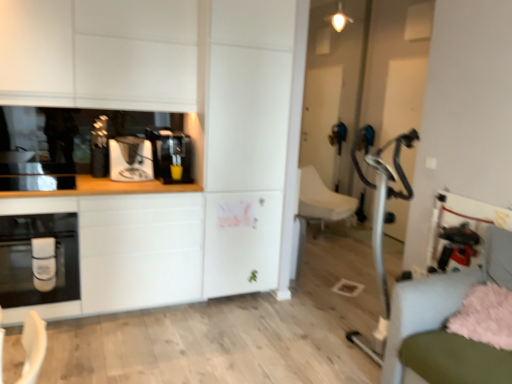
Measure the distance between point (x=173, y=40) and camera.

Point (x=173, y=40) and camera are 9.63 feet apart.

What do you see at coordinates (99, 54) in the screenshot? I see `white matte cabinet at upper left` at bounding box center [99, 54].

What do you see at coordinates (170, 156) in the screenshot? The image size is (512, 384). I see `black plastic coffee machine at left, the 2th coffee machine from the left` at bounding box center [170, 156].

What do you see at coordinates (484, 316) in the screenshot?
I see `fluffy pink pillow at lower right` at bounding box center [484, 316].

Image resolution: width=512 pixels, height=384 pixels. Find the location of `fluffy pink pillow at lower right`. fluffy pink pillow at lower right is located at coordinates (484, 316).

Looking at this image, measure the distance between point (x=5, y=179) and camera.

2.74 meters.

You are a GUI agent. You are given a task and a screenshot of the screen. Output one action in this format:
    pyautogui.click(x=<x>, y=<y>)
    Task: Click on the white matte cabinet at upper left
    
    Given the screenshot: What is the action you would take?
    pyautogui.click(x=99, y=54)

Which is in front, point (140, 74) or point (415, 301)?

The point (415, 301) is in front.

From a real-world perspective, between white matte cabinet at upper left and light blue fabric swivel chair at lower right, positioned as the second swivel chair in back-to-front order, who is vertically higher?

white matte cabinet at upper left.

Which of these two, white matte cabinet at upper left or light blue fabric swivel chair at lower right, acting as the 1th swivel chair starting from the front, is bigger?

With larger size is white matte cabinet at upper left.

Looking at this image, in the image, is white matte cabinet at upper left on the left side or the right side of light blue fabric swivel chair at lower right, acting as the 1th swivel chair starting from the front?

Based on their positions, white matte cabinet at upper left is located to the left of light blue fabric swivel chair at lower right, acting as the 1th swivel chair starting from the front.

Is point (408, 297) less distant than point (68, 217)?

Yes, it is.

Can we say light blue fabric swivel chair at lower right, acting as the 1th swivel chair starting from the front, lies outside matte black oven at left?

light blue fabric swivel chair at lower right, acting as the 1th swivel chair starting from the front, is positioned outside matte black oven at left.

Is light blue fabric swivel chair at lower right, positioned as the second swivel chair in back-to-front order, taller than matte black oven at left?

Yes.

Is white fabric swivel chair at center, placed as the 2th swivel chair when sorted from front to back, wider than black glossy toaster at left?

Yes.

Looking at the image, does white fabric swivel chair at center, positioned as the first swivel chair in back-to-front order, seem bigger or smaller compared to black glossy toaster at left?

Clearly, white fabric swivel chair at center, positioned as the first swivel chair in back-to-front order, is larger in size than black glossy toaster at left.

Consider the image. From the image's perspective, would you say white fabric swivel chair at center, positioned as the first swivel chair in back-to-front order, is shown under black glossy toaster at left?

Correct, white fabric swivel chair at center, positioned as the first swivel chair in back-to-front order, appears lower than black glossy toaster at left in the image.

Is white fabric swivel chair at center, placed as the 2th swivel chair when sorted from front to back, far from black glossy toaster at left?

Indeed, white fabric swivel chair at center, placed as the 2th swivel chair when sorted from front to back, is not near black glossy toaster at left.

Which is more to the right, white fabric swivel chair at center, positioned as the first swivel chair in back-to-front order, or matte black oven at left?

white fabric swivel chair at center, positioned as the first swivel chair in back-to-front order, is more to the right.

From the image's perspective, is white fabric swivel chair at center, positioned as the first swivel chair in back-to-front order, located above or below matte black oven at left?

white fabric swivel chair at center, positioned as the first swivel chair in back-to-front order, is above matte black oven at left.

Between white fabric swivel chair at center, positioned as the first swivel chair in back-to-front order, and matte black oven at left, which one has larger size?

Bigger between the two is white fabric swivel chair at center, positioned as the first swivel chair in back-to-front order.

Which object is thinner, white fabric swivel chair at center, placed as the 2th swivel chair when sorted from front to back, or matte black oven at left?

Thinner between the two is matte black oven at left.

Find the location of a particular element. The width and height of the screenshot is (512, 384). home appliance behind the fluffy pink pillow at lower right is located at coordinates (32, 257).

Are fluffy pink pillow at lower right and matte black oven at left beside each other?

fluffy pink pillow at lower right and matte black oven at left are not in contact.

From the image's perspective, who appears lower, fluffy pink pillow at lower right or matte black oven at left?

fluffy pink pillow at lower right, from the image's perspective.

From a real-world perspective, between fluffy pink pillow at lower right and matte black oven at left, who is vertically higher?

fluffy pink pillow at lower right is physically above.

Considering the positions of point (185, 151) and point (126, 160), is point (185, 151) closer or farther from the camera than point (126, 160)?

Point (185, 151).

From the image's perspective, which object appears higher, black plastic coffee machine at left, the 1th coffee machine positioned from the right, or satin black coffee machine at left, the 1th coffee machine positioned from the left?

From the image's view, black plastic coffee machine at left, the 1th coffee machine positioned from the right, is above.

Is black plastic coffee machine at left, the 2th coffee machine from the left, touching satin black coffee machine at left, acting as the second coffee machine starting from the right?

No, black plastic coffee machine at left, the 2th coffee machine from the left, is not making contact with satin black coffee machine at left, acting as the second coffee machine starting from the right.

Does black plastic coffee machine at left, the 2th coffee machine from the left, turn towards satin black coffee machine at left, the 1th coffee machine positioned from the left?

No, black plastic coffee machine at left, the 2th coffee machine from the left, is not oriented towards satin black coffee machine at left, the 1th coffee machine positioned from the left.

Considering the relative sizes of satin black coffee machine at left, acting as the second coffee machine starting from the right, and white fabric swivel chair at center, placed as the 2th swivel chair when sorted from front to back, in the image provided, is satin black coffee machine at left, acting as the second coffee machine starting from the right, bigger than white fabric swivel chair at center, placed as the 2th swivel chair when sorted from front to back,?

Incorrect, satin black coffee machine at left, acting as the second coffee machine starting from the right, is not larger than white fabric swivel chair at center, placed as the 2th swivel chair when sorted from front to back.

From the image's perspective, who appears lower, satin black coffee machine at left, the 1th coffee machine positioned from the left, or white fabric swivel chair at center, placed as the 2th swivel chair when sorted from front to back?

white fabric swivel chair at center, placed as the 2th swivel chair when sorted from front to back, appears lower in the image.

Would you say satin black coffee machine at left, the 1th coffee machine positioned from the left, is inside or outside white fabric swivel chair at center, placed as the 2th swivel chair when sorted from front to back?

satin black coffee machine at left, the 1th coffee machine positioned from the left, lies outside white fabric swivel chair at center, placed as the 2th swivel chair when sorted from front to back.

Would you say satin black coffee machine at left, the 1th coffee machine positioned from the left, is a long distance from white fabric swivel chair at center, placed as the 2th swivel chair when sorted from front to back?

Yes, satin black coffee machine at left, the 1th coffee machine positioned from the left, and white fabric swivel chair at center, placed as the 2th swivel chair when sorted from front to back, are quite far apart.

You are a GUI agent. You are given a task and a screenshot of the screen. Output one action in this format:
    pyautogui.click(x=<x>, y=<y>)
    Task: Click on the 2nd swivel chair to the right of the white matte cabinet at upper left, starting your count from the anchor
    The width and height of the screenshot is (512, 384).
    Given the screenshot: What is the action you would take?
    pyautogui.click(x=442, y=322)

Find the location of a particular element. The width and height of the screenshot is (512, 384). home appliance on the left of light blue fabric swivel chair at lower right, acting as the 1th swivel chair starting from the front is located at coordinates (32, 257).

Which object lies nearer to the anchor point white fabric swivel chair at center, placed as the 2th swivel chair when sorted from front to back, black plastic coffee machine at left, the 2th coffee machine from the left, or black glossy toaster at left?

black plastic coffee machine at left, the 2th coffee machine from the left, lies closer to white fabric swivel chair at center, placed as the 2th swivel chair when sorted from front to back, than the other object.

Looking at the image, which one is located closer to white fabric swivel chair at center, positioned as the first swivel chair in back-to-front order, white matte countertop at left or matte black oven at left?

The object closer to white fabric swivel chair at center, positioned as the first swivel chair in back-to-front order, is white matte countertop at left.

Considering their positions, is satin black coffee machine at left, the 1th coffee machine positioned from the left, positioned closer to white fabric swivel chair at center, placed as the 2th swivel chair when sorted from front to back, than light blue fabric swivel chair at lower right, acting as the 1th swivel chair starting from the front?

satin black coffee machine at left, the 1th coffee machine positioned from the left.

Based on their spatial positions, is white matte cabinet at upper left or matte black oven at left further from white matte countertop at left?

white matte cabinet at upper left lies further to white matte countertop at left than the other object.

Based on the photo, based on their spatial positions, is black plastic coffee machine at left, the 1th coffee machine positioned from the right, or white matte countertop at left closer to satin black coffee machine at left, acting as the second coffee machine starting from the right?

Among the two, black plastic coffee machine at left, the 1th coffee machine positioned from the right, is located nearer to satin black coffee machine at left, acting as the second coffee machine starting from the right.

Estimate the real-world distances between objects in this image. Which object is closer to light blue fabric swivel chair at lower right, acting as the 1th swivel chair starting from the front, white matte countertop at left or fluffy pink pillow at lower right?

Among the two, fluffy pink pillow at lower right is located nearer to light blue fabric swivel chair at lower right, acting as the 1th swivel chair starting from the front.

From the image, which object appears to be nearer to light blue fabric swivel chair at lower right, positioned as the second swivel chair in back-to-front order, satin black coffee machine at left, the 1th coffee machine positioned from the left, or matte black oven at left?

Among the two, satin black coffee machine at left, the 1th coffee machine positioned from the left, is located nearer to light blue fabric swivel chair at lower right, positioned as the second swivel chair in back-to-front order.

Looking at the image, which one is located closer to black glossy toaster at left, satin black coffee machine at left, the 1th coffee machine positioned from the left, or fluffy pink pillow at lower right?

Among the two, satin black coffee machine at left, the 1th coffee machine positioned from the left, is located nearer to black glossy toaster at left.

Locate an element on the screen. This screenshot has height=384, width=512. appliance between matte black oven at left and satin black coffee machine at left, acting as the second coffee machine starting from the right, in the horizontal direction is located at coordinates (37, 183).

I want to click on appliance between white matte cabinet at upper left and white matte countertop at left in the vertical direction, so click(37, 183).

I want to click on appliance between light blue fabric swivel chair at lower right, acting as the 1th swivel chair starting from the front, and white fabric swivel chair at center, placed as the 2th swivel chair when sorted from front to back, from front to back, so click(x=37, y=183).

This screenshot has height=384, width=512. What are the coordinates of `cabinetry between black glossy toaster at left and white fabric swivel chair at center, placed as the 2th swivel chair when sorted from front to back` in the screenshot? It's located at (99, 54).